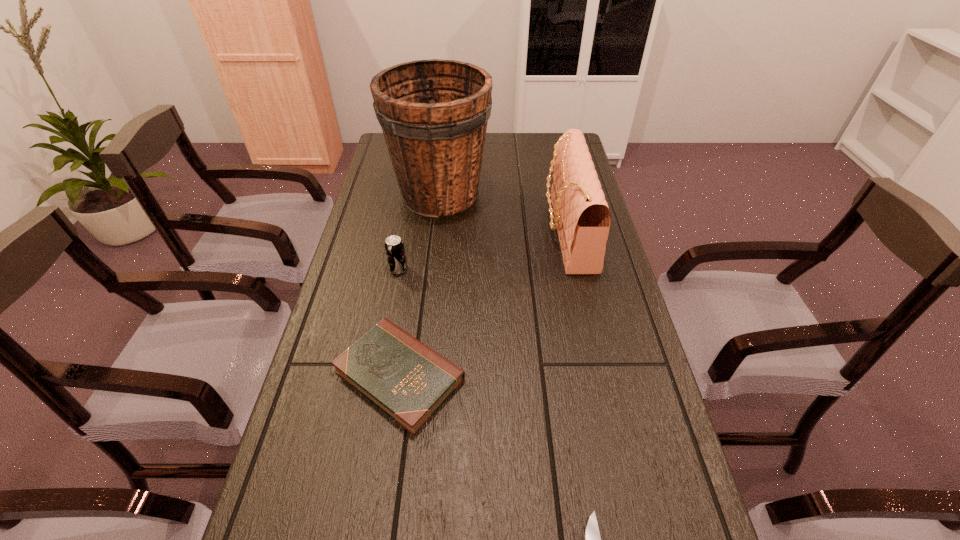
Locate an element on the screen. vacant space that is in between the second nearest object and the second tallest object is located at coordinates (484, 303).

Locate an element on the screen. This screenshot has width=960, height=540. empty space that is in between the handbag and the tallest object is located at coordinates click(x=504, y=213).

At what (x,y) coordinates should I click in order to perform the action: click on vacant point located between the handbag and the fourth tallest object. Please return your answer as a coordinate pair (x, y). This screenshot has height=540, width=960. Looking at the image, I should click on (484, 303).

The image size is (960, 540). I want to click on blank region between the Bible and the soda can, so coord(399,322).

Find the location of a particular element. object that ranks as the closest to the bucket is located at coordinates (582, 218).

Locate an element on the screen. object that stands as the fourth closest to the second shortest object is located at coordinates (433, 113).

Identify the location of blank space that satisfies the following two spatial constraints: 1. on the back side of the fourth tallest object; 2. on the right side of the tallest object. Image resolution: width=960 pixels, height=540 pixels. (426, 194).

Identify the location of free space that satisfies the following two spatial constraints: 1. on the back side of the bucket; 2. on the left side of the fourth farthest object. (426, 194).